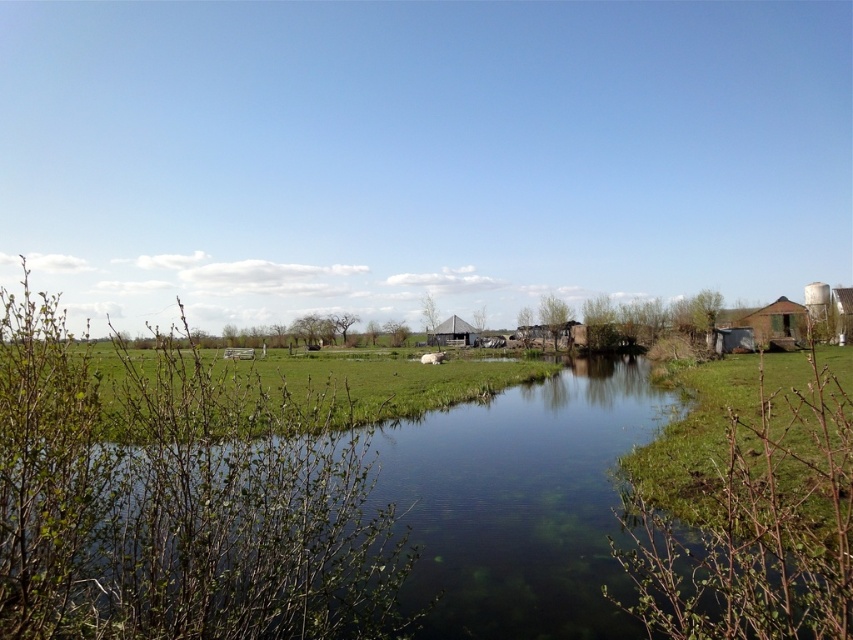
Which is behind, point (759, 314) or point (474, 339)?

The point (474, 339) is more distant.

Between brown wooden hut at right and gray corrugated metal hut at center, which one appears on the right side from the viewer's perspective?

brown wooden hut at right is more to the right.

The height and width of the screenshot is (640, 853). Describe the element at coordinates (776, 324) in the screenshot. I see `brown wooden hut at right` at that location.

Identify the location of brown wooden hut at right. This screenshot has height=640, width=853. (776, 324).

Can you confirm if green grass at center is positioned below brown wooden hut at right?

Correct, green grass at center is located below brown wooden hut at right.

Who is more distant from viewer, [45,406] or [766,326]?

Positioned behind is point [766,326].

Identify the location of green grass at center. (228, 390).

Based on the photo, who is positioned more to the left, green grass at center or green grass at lower right?

From the viewer's perspective, green grass at center appears more on the left side.

Identify the location of green grass at center. Image resolution: width=853 pixels, height=640 pixels. (228, 390).

At what (x,y) coordinates should I click in order to perform the action: click on green grass at center. Please return your answer as a coordinate pair (x, y). The image size is (853, 640). Looking at the image, I should click on (228, 390).

Identify the location of green grass at center. (228, 390).